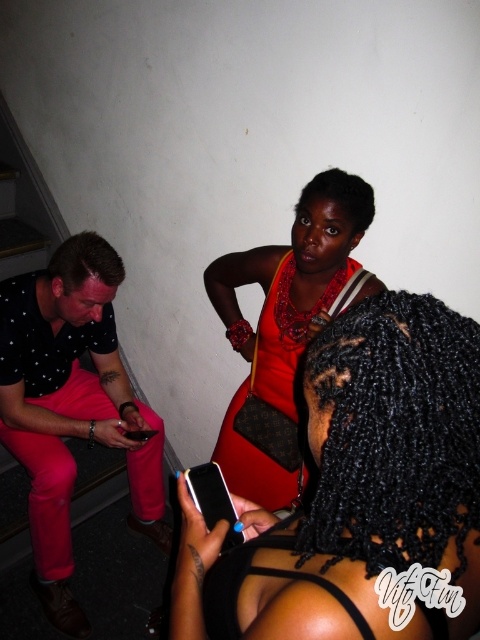
You are standing in the stairwell and want to locate the shiny red dress at center. According to the coordinates provided, which direction should you look relative to the man in the black shirt with pink pants?

The shiny red dress at center is located at coordinates point (357, 490), which is to the right of the man in the black shirt with pink pants.

You are standing at the bottom of the stairs and see the shiny red dress at center and the polka dot fabric shirt at left. Which one is higher up?

The shiny red dress at center is higher up because it is positioned above the polka dot fabric shirt at left.

You are at a party and want to find the shiny orange fabric dress at center. Which direction should you look relative to the shiny red dress at center?

The shiny orange fabric dress at center is to the left of the shiny red dress at center.